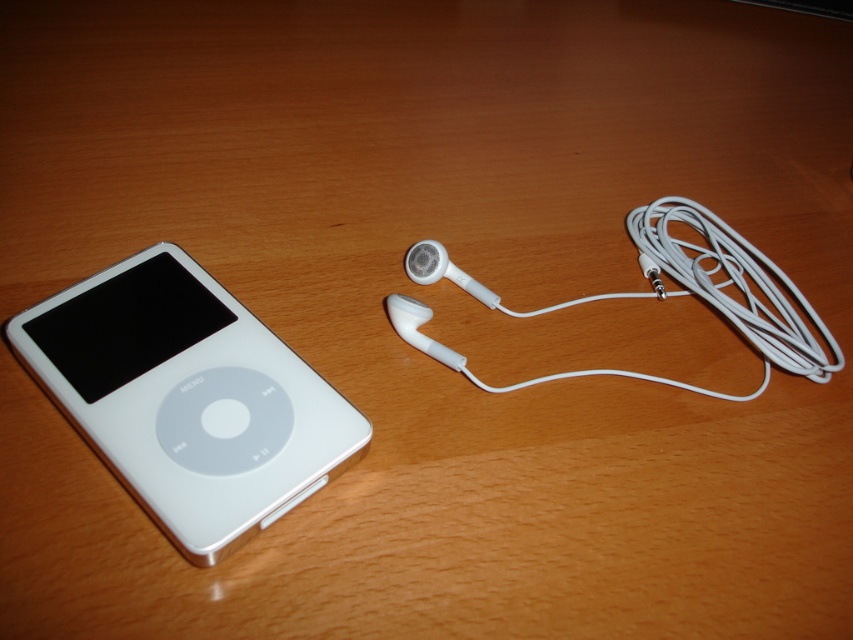
You are holding a small toy car that is 15 centimeters long. You want to drive it from the point marked at (230, 392) to the edge of the wooden surface. Is there enough space for the toy car to move without falling off?

The distance between the point marked at (230, 392) and the edge of the wooden surface is 1.04 meters. Since the toy car is only 15 centimeters long, there is more than enough space for it to move safely without falling off.

You are organizing a desk and need to place an object at coordinate point A. The white plastic ipod at left is already placed at point B. Which coordinate should you avoid placing the new object to prevent overlapping?

You should avoid placing the new object at point B, which is the location of the white plastic ipod at left at coordinates (187, 397), to prevent overlapping.

You are setting up a small display on the wooden surface. You want to place a decorative item that is 3 inches tall between the white plastic ipod at left and the white matte earphone at center right. Considering their heights, will the decorative item be visible above both?

The white plastic ipod at left is taller than the white matte earphone at center right. Since the decorative item is 3 inches tall, it needs to be taller than both objects to be visible above them. However, since the iPod is taller than the earphone, if the iPod is taller than 3 inches, the decorative item would be shorter and thus not visible above the iPod. Without specific height measurements for the iPod and earphone, we cannot definitively determine visibility. Please provide the exact heights of both.